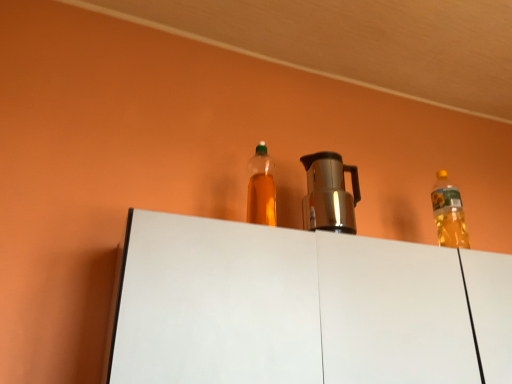
Question: Considering the relative sizes of translucent plastic bottle at center and white matte cabinet at center in the image provided, is translucent plastic bottle at center taller than white matte cabinet at center?

Choices:
 (A) yes
 (B) no

Answer: (B)

Question: Is translucent plastic bottle at center positioned before white matte cabinet at center?

Choices:
 (A) yes
 (B) no

Answer: (B)

Question: Is translucent plastic bottle at center touching white matte cabinet at center?

Choices:
 (A) yes
 (B) no

Answer: (B)

Question: Can you confirm if translucent plastic bottle at center is thinner than white matte cabinet at center?

Choices:
 (A) no
 (B) yes

Answer: (B)

Question: Is translucent plastic bottle at center positioned far away from white matte cabinet at center?

Choices:
 (A) yes
 (B) no

Answer: (B)

Question: Considering the relative sizes of translucent plastic bottle at center and white matte cabinet at center in the image provided, is translucent plastic bottle at center smaller than white matte cabinet at center?

Choices:
 (A) yes
 (B) no

Answer: (A)

Question: From a real-world perspective, is white matte cabinet at center positioned over satin silver coffee pot at center based on gravity?

Choices:
 (A) yes
 (B) no

Answer: (B)

Question: From the image's perspective, is white matte cabinet at center over satin silver coffee pot at center?

Choices:
 (A) no
 (B) yes

Answer: (A)

Question: Can satin silver coffee pot at center be found inside white matte cabinet at center?

Choices:
 (A) yes
 (B) no

Answer: (B)

Question: Are white matte cabinet at center and satin silver coffee pot at center far apart?

Choices:
 (A) no
 (B) yes

Answer: (B)

Question: Does white matte cabinet at center have a lesser height compared to satin silver coffee pot at center?

Choices:
 (A) no
 (B) yes

Answer: (A)

Question: Does white matte cabinet at center have a lesser width compared to satin silver coffee pot at center?

Choices:
 (A) yes
 (B) no

Answer: (B)

Question: Is satin silver coffee pot at center next to white matte cabinet at center and touching it?

Choices:
 (A) yes
 (B) no

Answer: (B)